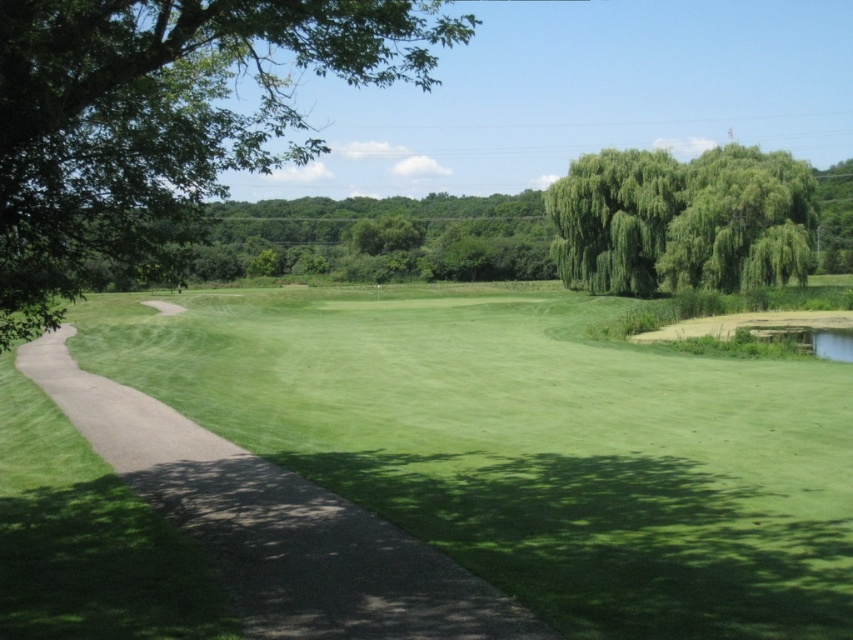
You are a golfer standing on the fairway and see the gray asphalt path at left and the green leafy tree at upper center. Which object is positioned to the left of the other?

The gray asphalt path at left is to the left of the green leafy tree at upper center.

You are a golfer standing at the starting point of the gray asphalt path at left. You want to hit a golf ball towards the green leafy tree at upper center. Will the tree block your shot? Explain why.

The gray asphalt path at left is in front of the green leafy tree at upper center, so the tree will not block your shot because the path is between you and the tree.

You are standing on the golf course and want to place a flag at the point marked as point (252,586). If your golf ball is currently 30 feet away from you, can you reach the point with one shot?

The point (252,586) is 25.35 feet away from the viewer. Since your golf ball is 30 feet away, you can reach the point with one shot as it is within range.